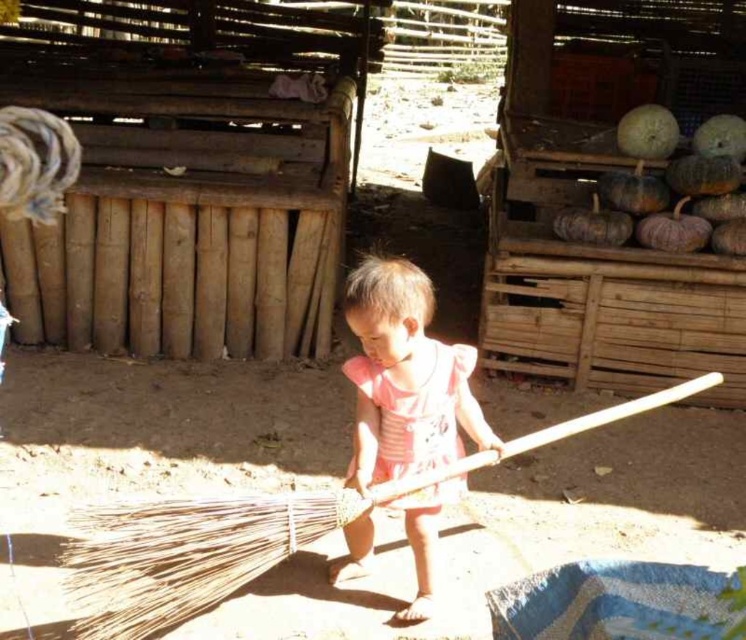
You are a photographer trying to capture the child holding the bamboo broom at center and the pink fabric dress at center. Which object should you focus on first if you want to ensure both are in focus without adjusting the camera settings?

The bamboo broom at center is below the pink fabric dress at center, so focusing on the pink fabric dress at center first would ensure both are in focus since it is closer to the camera.

The child is holding the bamboo broom at center and wearing the pink fabric dress at center. Which item is located to the left of the other?

The bamboo broom at center is positioned on the right side of pink fabric dress at center, so the pink fabric dress at center is to the left of the bamboo broom at center.